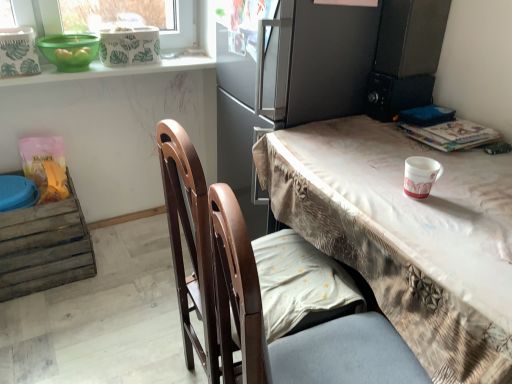
Where is `blank space above hardcover book at upper right (from a real-world perspective)`? blank space above hardcover book at upper right (from a real-world perspective) is located at coordinates (450, 120).